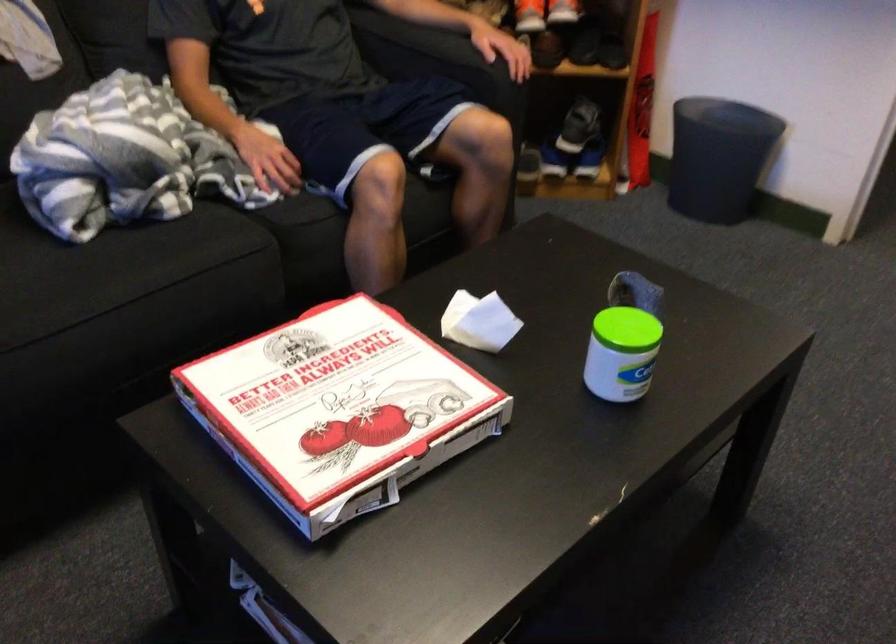
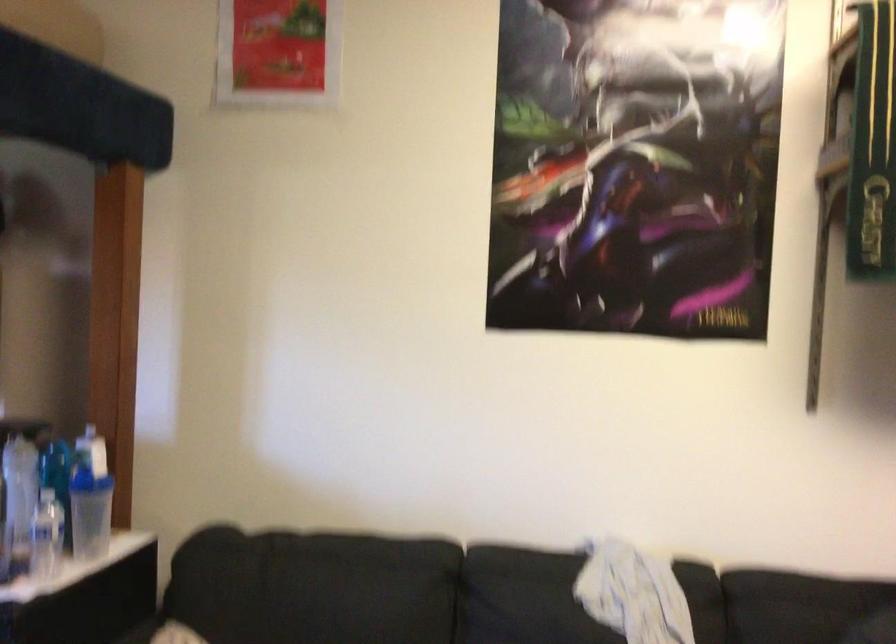
The first image is from the beginning of the video and the second image is from the end. How did the camera likely rotate when shooting the video?

The rotation direction of the camera is left-up.